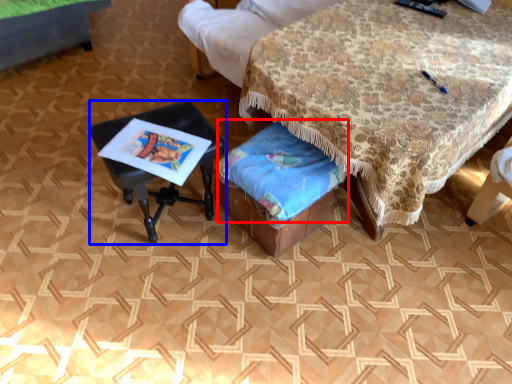
Question: Among these objects, which one is nearest to the camera, blanket (highlighted by a red box) or table (highlighted by a blue box)?

Choices:
 (A) blanket
 (B) table

Answer: (A)